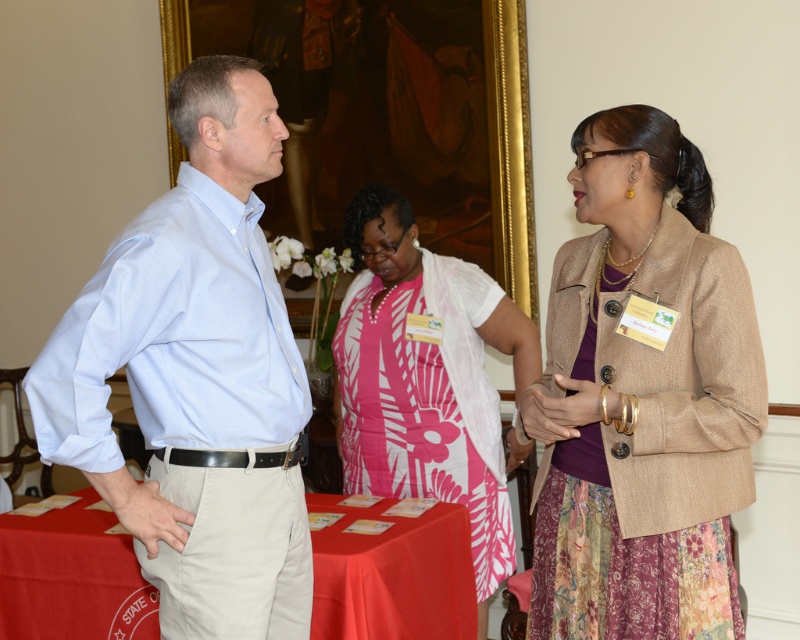
Question: Which point is closer to the camera?

Choices:
 (A) 354,403
 (B) 226,572
 (C) 660,449

Answer: (B)

Question: Is beige textured blazer at right wider than pink fabric dress at center?

Choices:
 (A) no
 (B) yes

Answer: (A)

Question: Is beige textured blazer at right positioned in front of red cloth table at lower left?

Choices:
 (A) no
 (B) yes

Answer: (B)

Question: Does light blue shirt at left appear on the right side of pink fabric dress at center?

Choices:
 (A) yes
 (B) no

Answer: (B)

Question: Which object appears farthest from the camera in this image?

Choices:
 (A) red cloth table at lower left
 (B) light blue shirt at left
 (C) pink fabric dress at center

Answer: (C)

Question: Which object appears closest to the camera in this image?

Choices:
 (A) beige textured blazer at right
 (B) pink fabric dress at center
 (C) red cloth table at lower left

Answer: (A)